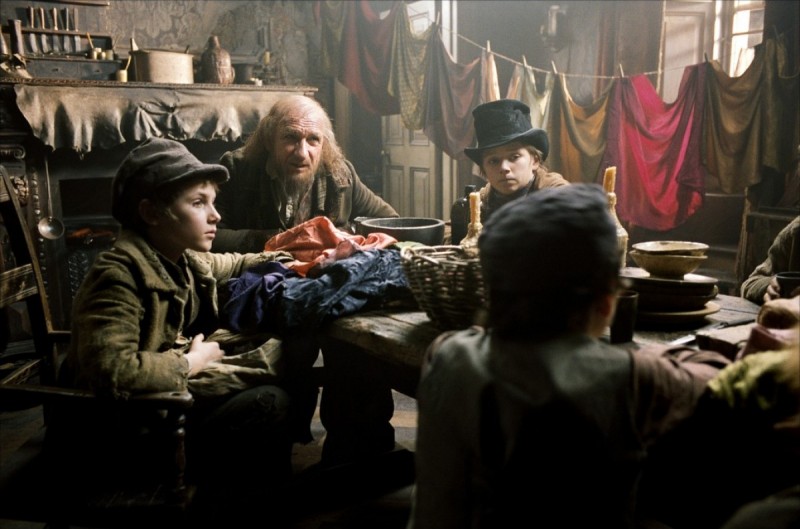
Locate an element on the screen. Image resolution: width=800 pixels, height=529 pixels. stack of bowls is located at coordinates (668, 250).